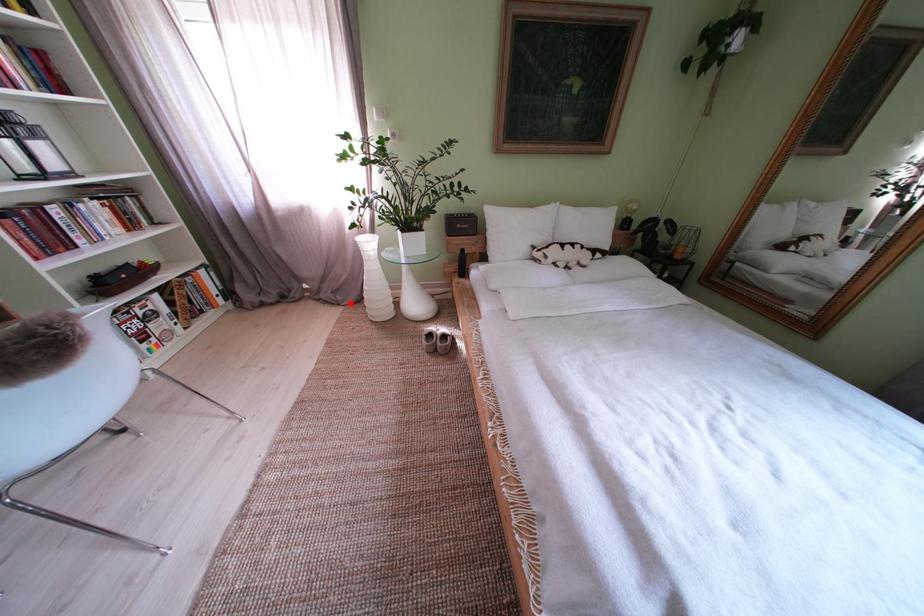
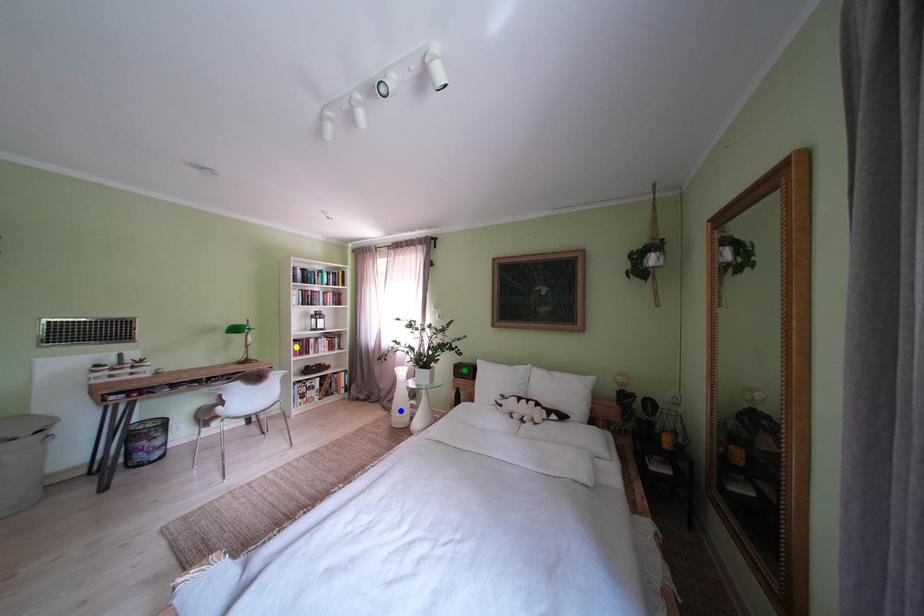
Question: I am providing you with two images of the same scene from different viewpoints. A red point is marked on the first image. You are given multiple points on the second image. Can you choose the point in image 2 that corresponds to the point in image 1?

Choices:
 (A) green point
 (B) yellow point
 (C) blue point

Answer: (C)